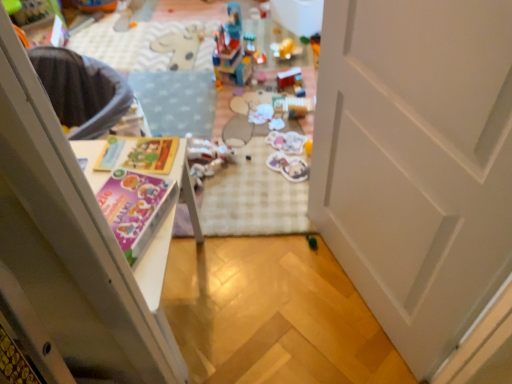
Locate an element on the screen. The image size is (512, 384). free area in between matte plastic stickers at center, the second toy from the bottom, and translucent plastic stickers at center, arranged as the third toy when viewed from the top is located at coordinates (281, 151).